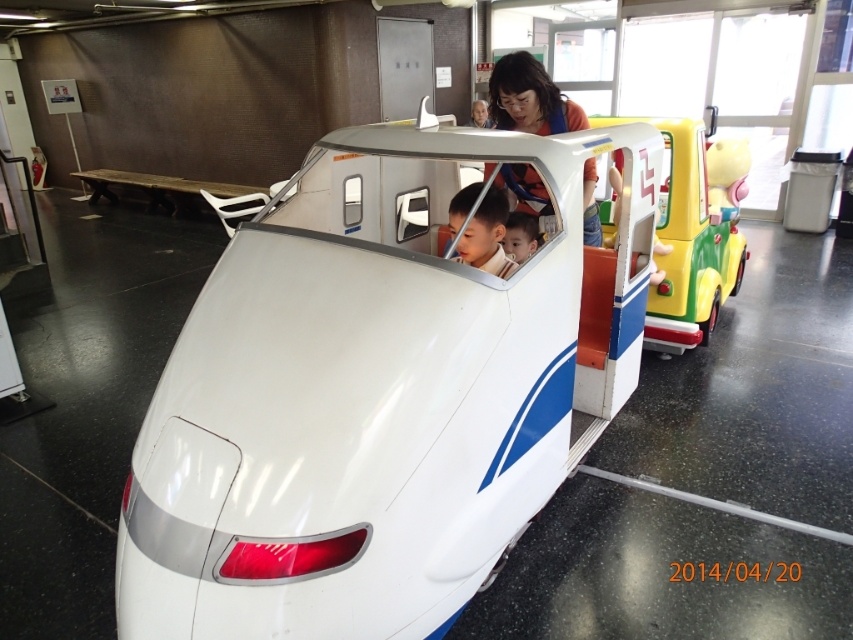
Where is `white glossy train at center`? The width and height of the screenshot is (853, 640). white glossy train at center is located at coordinates (375, 394).

Is white glossy train at center in front of matte white boy at center?

Yes.

Between point (227, 305) and point (456, 230), which one is positioned behind?

Point (456, 230)

The height and width of the screenshot is (640, 853). I want to click on white glossy train at center, so click(x=375, y=394).

At what (x,y) coordinates should I click in order to perform the action: click on white glossy train at center. Please return your answer as a coordinate pair (x, y). Looking at the image, I should click on (375, 394).

Is the position of white glossy train at center more distant than that of smooth skin face at center?

No, it is not.

Image resolution: width=853 pixels, height=640 pixels. What do you see at coordinates (375, 394) in the screenshot?
I see `white glossy train at center` at bounding box center [375, 394].

Find the location of a particular element. Image resolution: width=853 pixels, height=640 pixels. white glossy train at center is located at coordinates (375, 394).

Is point (523, 202) closer to viewer compared to point (460, 241)?

No, (523, 202) is further to viewer.

Does matte orange shirt at upper center appear over matte white boy at center?

Correct, matte orange shirt at upper center is located above matte white boy at center.

This screenshot has height=640, width=853. Describe the element at coordinates (529, 99) in the screenshot. I see `matte orange shirt at upper center` at that location.

Find the location of a particular element. This screenshot has height=640, width=853. matte orange shirt at upper center is located at coordinates (529, 99).